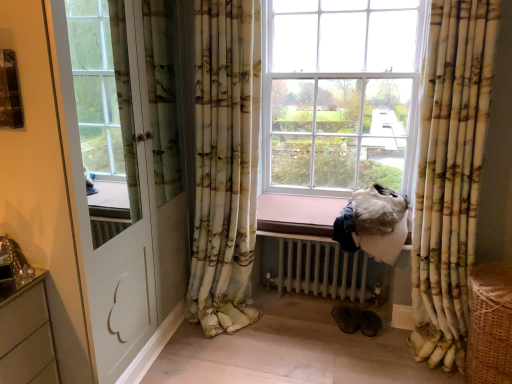
Question: Considering the relative positions of floral fabric curtain at center, acting as the second curtain starting from the right, and white painted metal radiator at lower center in the image provided, is floral fabric curtain at center, acting as the second curtain starting from the right, to the left or to the right of white painted metal radiator at lower center?

Choices:
 (A) left
 (B) right

Answer: (A)

Question: Considering the positions of floral fabric curtain at center, acting as the second curtain starting from the right, and white painted metal radiator at lower center in the image, is floral fabric curtain at center, acting as the second curtain starting from the right, wider or thinner than white painted metal radiator at lower center?

Choices:
 (A) thin
 (B) wide

Answer: (A)

Question: Which of these objects is positioned farthest from the floral fabric curtain at right, the second curtain in the left-to-right sequence?

Choices:
 (A) white painted metal radiator at lower center
 (B) floral fabric curtain at center, acting as the second curtain starting from the right
 (C) brown woven basket at lower right
 (D) white glossy door at left

Answer: (D)

Question: Estimate the real-world distances between objects in this image. Which object is closer to the brown woven basket at lower right?

Choices:
 (A) white painted metal radiator at lower center
 (B) floral fabric curtain at right, the second curtain in the left-to-right sequence
 (C) floral fabric curtain at center, arranged as the 1th curtain when viewed from the left
 (D) white glossy door at left

Answer: (B)